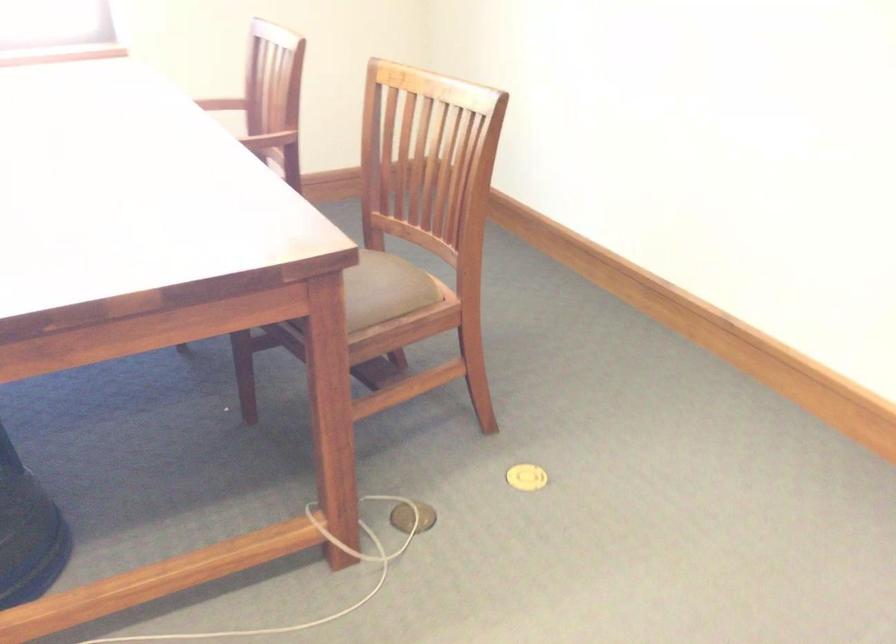
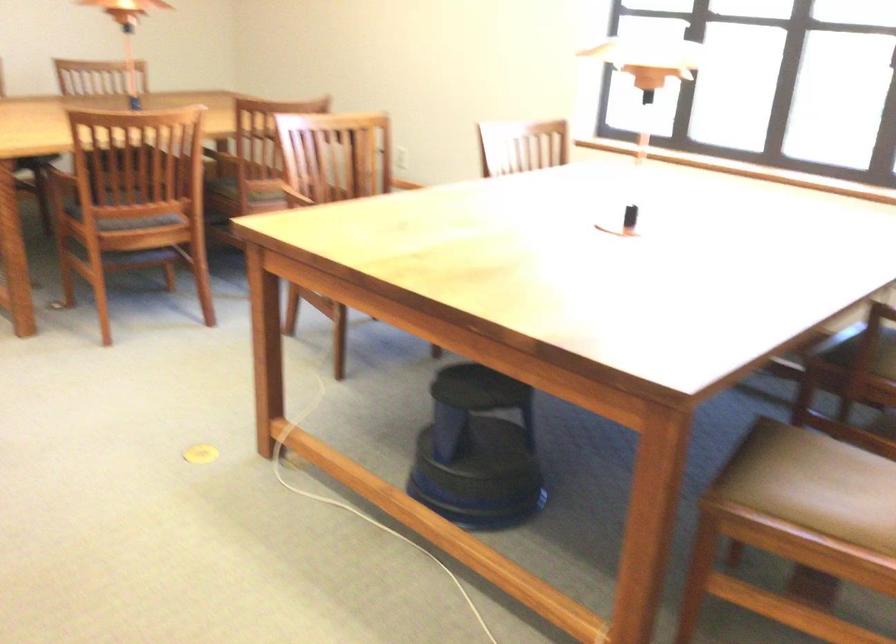
Question: The images are taken continuously from a first-person perspective. In which direction is your viewpoint rotating?

Choices:
 (A) Left
 (B) Right
 (C) Up
 (D) Down

Answer: (A)